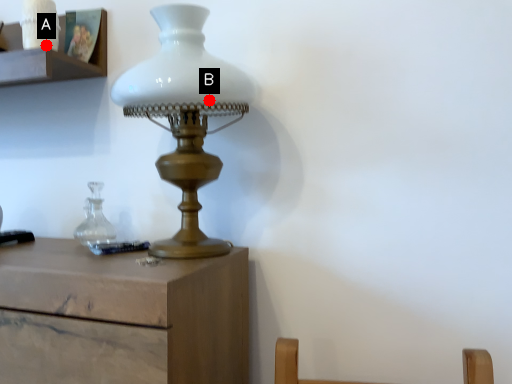
Question: Two points are circled on the image, labeled by A and B beside each circle. Which point is closer to the camera?

Choices:
 (A) A is closer
 (B) B is closer

Answer: (B)